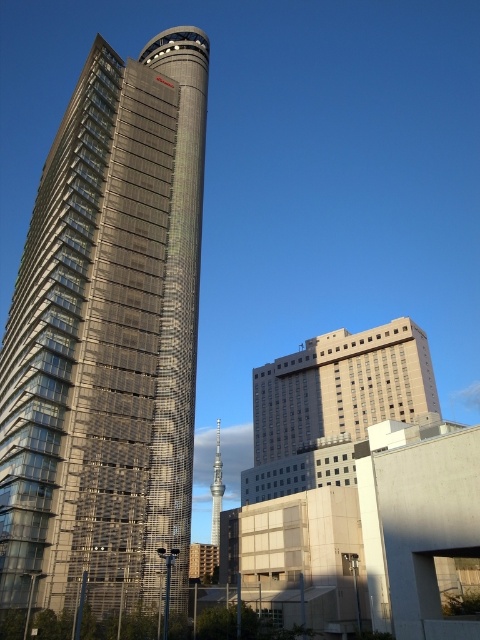
You are a drone operator who needs to fly a drone between the metallic glass skyscraper at center and the beige concrete building at center. The drone has a maximum flight distance of 60 meters. Can the drone safely complete the flight between them?

The metallic glass skyscraper at center and beige concrete building at center are 63.09 meters apart from each other. Since the drone can only fly up to 60 meters, it cannot safely complete the flight between them as the distance exceeds its maximum range.

You are a drone operator who needs to fly a drone between the metallic glass skyscraper at center and the glassy metallic tower at center. What is the minimum distance the drone must maintain between them to avoid collision?

The metallic glass skyscraper at center is 132.23 meters away from the glassy metallic tower at center. Therefore, the drone must maintain a minimum distance of 132.23 meters between them to avoid collision.